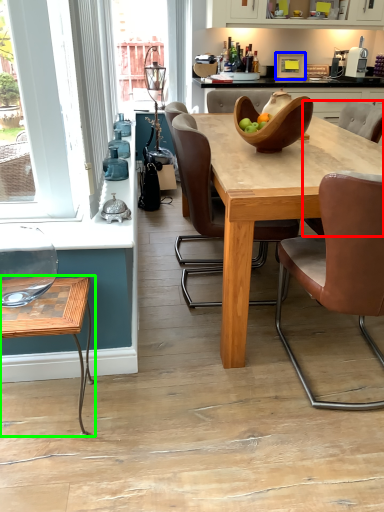
Question: Which is nearer to the chair (highlighted by a red box)? appliance (highlighted by a blue box) or coffee table (highlighted by a green box).

Choices:
 (A) appliance
 (B) coffee table

Answer: (A)